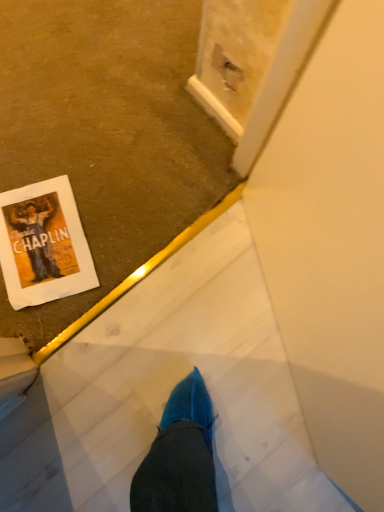
Locate an element on the screen. This screenshot has height=512, width=384. free space below white paper at lower left (from a real-world perspective) is located at coordinates pyautogui.click(x=40, y=240).